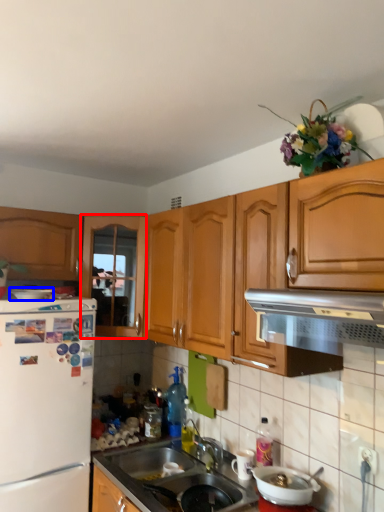
Question: Which of the following is the closest to the observer, cabinetry (highlighted by a red box) or appliance (highlighted by a blue box)?

Choices:
 (A) cabinetry
 (B) appliance

Answer: (B)